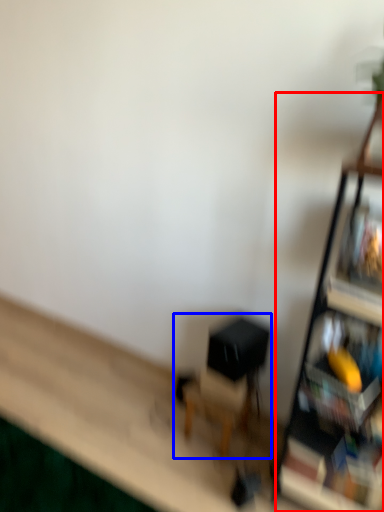
Question: Which object appears closest to the camera in this image, shelf (highlighted by a red box) or swivel chair (highlighted by a blue box)?

Choices:
 (A) shelf
 (B) swivel chair

Answer: (A)